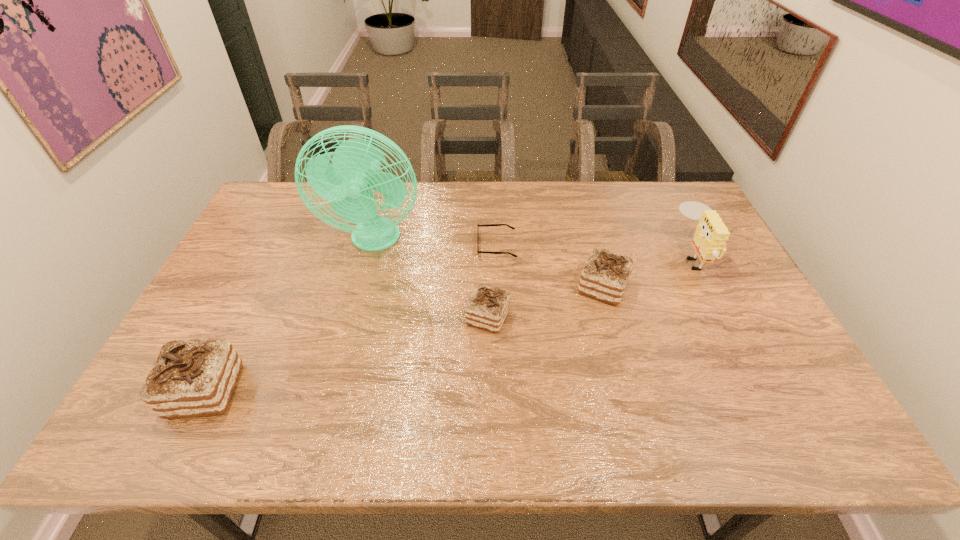
The width and height of the screenshot is (960, 540). I want to click on free space located 0.320m on the front-facing side of the rightmost object, so click(574, 256).

What are the coordinates of `object present at the near edge` in the screenshot? It's located at (191, 378).

Locate an element on the screen. Image resolution: width=960 pixels, height=540 pixels. object located at the left edge is located at coordinates (191, 378).

This screenshot has width=960, height=540. Find the location of `object that is at the right edge`. object that is at the right edge is located at coordinates (711, 234).

At what (x,y) coordinates should I click in order to perform the action: click on object present at the near left corner. Please return your answer as a coordinate pair (x, y). The image size is (960, 540). Looking at the image, I should click on 191,378.

Find the location of a particular element. free space at the far edge is located at coordinates point(425,197).

At what (x,y) coordinates should I click in order to perform the action: click on free space at the near edge of the desktop. Please return your answer as a coordinate pair (x, y). Image resolution: width=960 pixels, height=540 pixels. Looking at the image, I should click on [553, 399].

Find the location of `blank space at the left edge of the desktop`. blank space at the left edge of the desktop is located at coordinates (259, 291).

You are a GUI agent. You are given a task and a screenshot of the screen. Output one action in this format:
    pyautogui.click(x=<x>, y=<y>)
    Task: Click on the vacant region at the right edge of the desktop
    This screenshot has height=540, width=960.
    Given the screenshot: What is the action you would take?
    pyautogui.click(x=666, y=232)

Find the location of a particular element. The width and height of the screenshot is (960, 540). vacant space at the far left corner of the desktop is located at coordinates coord(276,201).